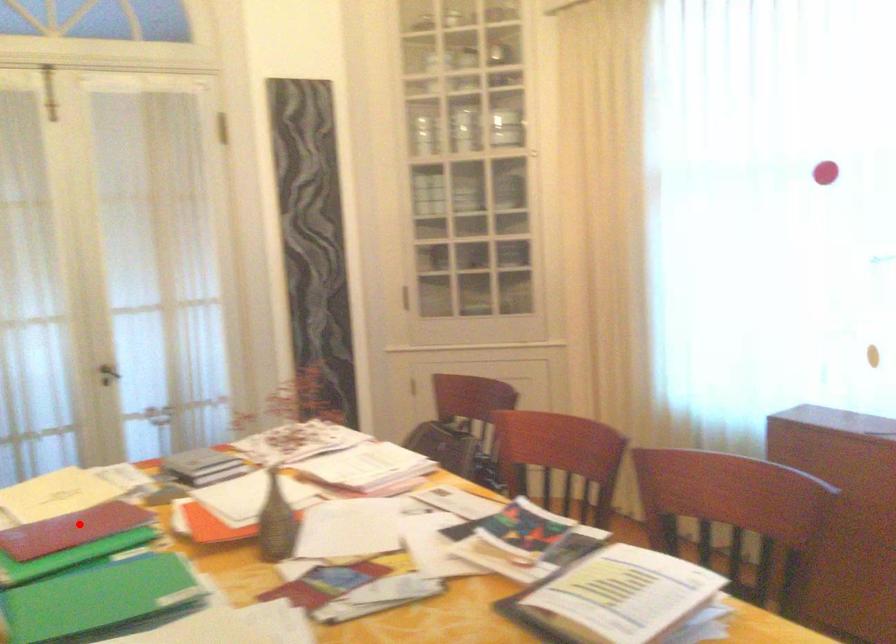
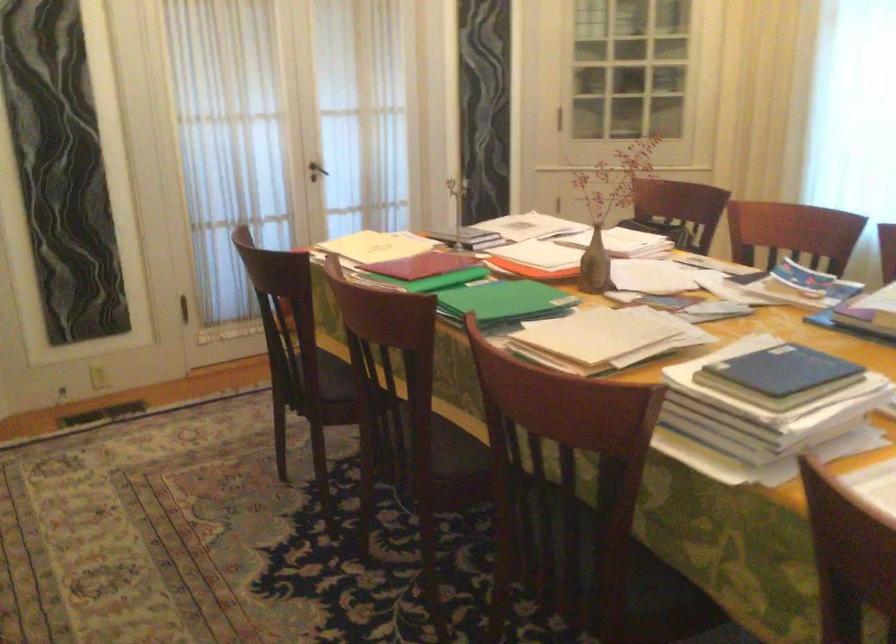
Find the pixel in the second image that matches the highlighted location in the first image.

(423, 265)